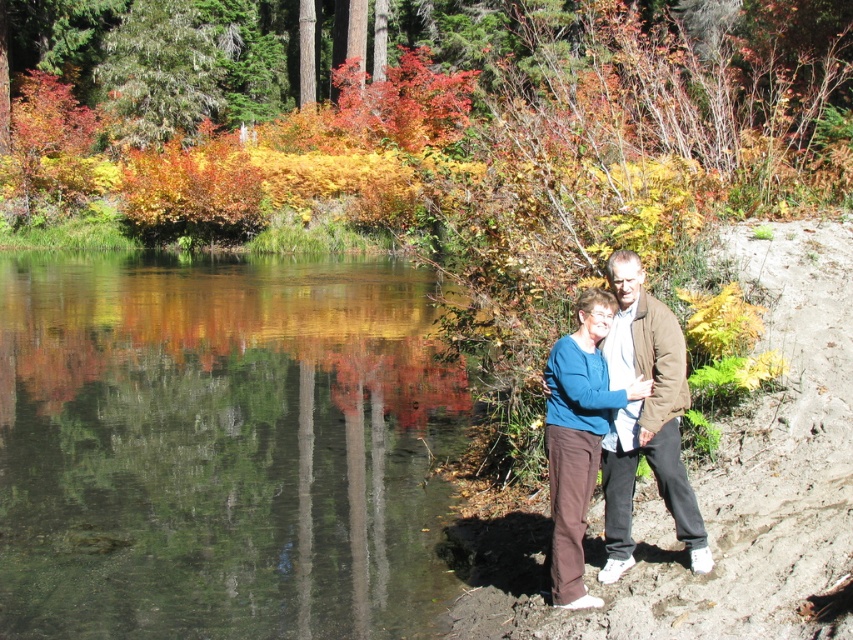
Question: Which of the following is the farthest from the observer?

Choices:
 (A) [x=630, y=512]
 (B) [x=74, y=310]

Answer: (B)

Question: Is the position of clear water at center less distant than that of blue sweater at center?

Choices:
 (A) no
 (B) yes

Answer: (A)

Question: Does clear water at center have a lesser width compared to blue sweater at center?

Choices:
 (A) yes
 (B) no

Answer: (B)

Question: Is clear water at center closer to the viewer compared to blue sweater at center?

Choices:
 (A) yes
 (B) no

Answer: (B)

Question: Which point is farther to the camera?

Choices:
 (A) (332, 522)
 (B) (663, 376)

Answer: (A)